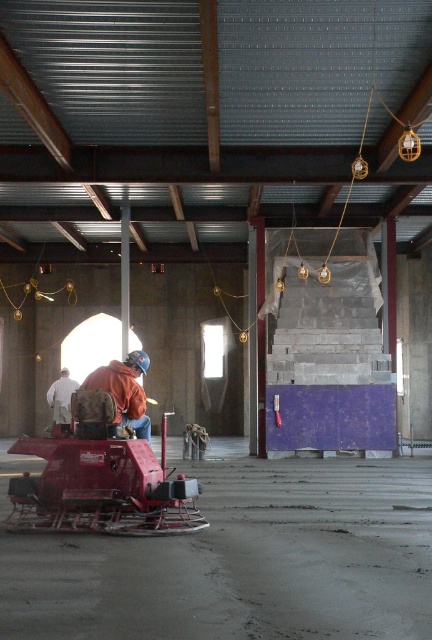
You are a construction worker who just arrived at the site and need to locate your brown leather backpack at center. Based on the coordinates provided, can you confirm if the backpack is positioned in the central area of the image?

The brown leather backpack at center is located at coordinates point (x=124, y=390), which corresponds to the central area of the image.

You are a construction worker who just arrived at the site. You see a brown leather backpack at center and a white fabric at center. Which one is bigger?

The brown leather backpack at center has a larger size compared to the white fabric at center.